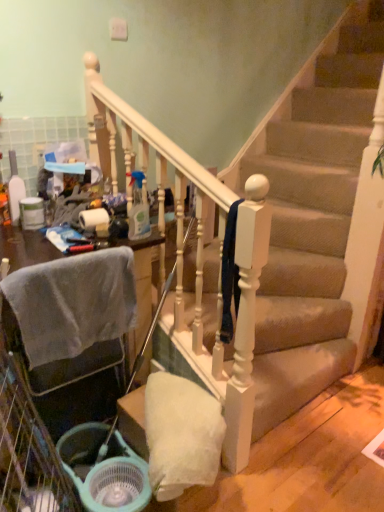
Image resolution: width=384 pixels, height=512 pixels. What do you see at coordinates (15, 189) in the screenshot? I see `translucent plastic spray bottle at left, which is counted as the 2th bottle, starting from the right` at bounding box center [15, 189].

Locate an element on the screen. light blue plastic shopping basket at lower left is located at coordinates (105, 470).

What is the approximate width of gray fabric chair at left?

gray fabric chair at left is 3.54 inches wide.

Where is `carpeted stairs at center`? The height and width of the screenshot is (512, 384). carpeted stairs at center is located at coordinates (317, 221).

Is translucent plastic spray bottle at left, which is counted as the 2th bottle, starting from the right, wider or thinner than carpeted stairs at center?

Clearly, translucent plastic spray bottle at left, which is counted as the 2th bottle, starting from the right, has less width compared to carpeted stairs at center.

In terms of size, does translucent plastic spray bottle at left, the first bottle positioned from the left, appear bigger or smaller than carpeted stairs at center?

Clearly, translucent plastic spray bottle at left, the first bottle positioned from the left, is smaller in size than carpeted stairs at center.

Consider the image. Do you think translucent plastic spray bottle at left, the first bottle positioned from the left, is within carpeted stairs at center, or outside of it?

translucent plastic spray bottle at left, the first bottle positioned from the left, is not enclosed by carpeted stairs at center.

Consider the image. How different are the orientations of translucent plastic spray bottle at left, which is counted as the 2th bottle, starting from the right, and carpeted stairs at center in degrees?

There is a 89.1-degree angle between the facing directions of translucent plastic spray bottle at left, which is counted as the 2th bottle, starting from the right, and carpeted stairs at center.

From the image's perspective, would you say carpeted stairs at center is shown under clear plastic spray bottle at center, which ranks as the second bottle in left-to-right order?

Yes.

Looking at this image, between carpeted stairs at center and clear plastic spray bottle at center, the 1th bottle in the right-to-left sequence, which one has more height?

carpeted stairs at center.

Is carpeted stairs at center smaller than clear plastic spray bottle at center, the 1th bottle in the right-to-left sequence?

No, carpeted stairs at center is not smaller than clear plastic spray bottle at center, the 1th bottle in the right-to-left sequence.

From the image's perspective, between clear plastic spray bottle at center, the 1th bottle in the right-to-left sequence, and white glossy toilet paper at upper left, which one is located above?

clear plastic spray bottle at center, the 1th bottle in the right-to-left sequence, is shown above in the image.

Does point (134, 221) come farther from viewer compared to point (102, 223)?

No.

Between clear plastic spray bottle at center, the 1th bottle in the right-to-left sequence, and white glossy toilet paper at upper left, which one has smaller size?

white glossy toilet paper at upper left.

Identify the location of bottle that is the 1st object above the white glossy toilet paper at upper left (from a real-world perspective). The width and height of the screenshot is (384, 512). (138, 209).

From a real-world perspective, is translucent plastic spray bottle at left, the first bottle positioned from the left, located beneath white glossy toilet paper at upper left?

No, from a real-world perspective, translucent plastic spray bottle at left, the first bottle positioned from the left, is not under white glossy toilet paper at upper left.

Can you confirm if translucent plastic spray bottle at left, which is counted as the 2th bottle, starting from the right, is shorter than white glossy toilet paper at upper left?

No, translucent plastic spray bottle at left, which is counted as the 2th bottle, starting from the right, is not shorter than white glossy toilet paper at upper left.

Is translucent plastic spray bottle at left, the first bottle positioned from the left, in front of or behind white glossy toilet paper at upper left in the image?

Clearly, translucent plastic spray bottle at left, the first bottle positioned from the left, is behind white glossy toilet paper at upper left.

Does point (11, 210) come behind point (154, 234)?

Yes.

From the image's perspective, is translucent plastic spray bottle at left, the first bottle positioned from the left, positioned above or below gray fabric chair at left?

Clearly, from the image's perspective, translucent plastic spray bottle at left, the first bottle positioned from the left, is above gray fabric chair at left.

Does translucent plastic spray bottle at left, the first bottle positioned from the left, have a greater height compared to gray fabric chair at left?

No.

Find the location of a particular element. The width and height of the screenshot is (384, 512). stairs on the right of the gray fabric chair at left is located at coordinates (317, 221).

From a real-world perspective, who is located higher, gray fabric chair at left or carpeted stairs at center?

carpeted stairs at center is physically above.

Can you tell me how much gray fabric chair at left and carpeted stairs at center differ in facing direction?

The angular difference between gray fabric chair at left and carpeted stairs at center is 89.1 degrees.

Is gray fabric chair at left taller than carpeted stairs at center?

Incorrect, the height of gray fabric chair at left is not larger of that of carpeted stairs at center.

Is light blue plastic shopping basket at lower left taller than carpeted stairs at center?

In fact, light blue plastic shopping basket at lower left may be shorter than carpeted stairs at center.

From the image's perspective, is light blue plastic shopping basket at lower left above or below carpeted stairs at center?

light blue plastic shopping basket at lower left is situated lower than carpeted stairs at center in the image.

Locate an element on the screen. This screenshot has width=384, height=512. shopping basket that is below the carpeted stairs at center (from the image's perspective) is located at coordinates (105, 470).

Which object is more forward, light blue plastic shopping basket at lower left or carpeted stairs at center?

carpeted stairs at center is closer to the camera.

At what (x,y) coordinates should I click in order to perform the action: click on the 2nd bottle positioned above the carpeted stairs at center (from a real-world perspective). Please return your answer as a coordinate pair (x, y). Looking at the image, I should click on (15, 189).

The width and height of the screenshot is (384, 512). In order to click on stairs below the clear plastic spray bottle at center, the 1th bottle in the right-to-left sequence (from the image's perspective) in this screenshot , I will do `click(317, 221)`.

Considering their positions, is light blue plastic shopping basket at lower left positioned further to white glossy toilet paper at upper left than clear plastic spray bottle at center, which ranks as the second bottle in left-to-right order?

light blue plastic shopping basket at lower left lies further to white glossy toilet paper at upper left than the other object.

From the image, which object appears to be farther from clear plastic spray bottle at center, the 1th bottle in the right-to-left sequence, carpeted stairs at center or light blue plastic shopping basket at lower left?

The object further to clear plastic spray bottle at center, the 1th bottle in the right-to-left sequence, is carpeted stairs at center.

Which object lies further to the anchor point translucent plastic spray bottle at left, the first bottle positioned from the left, gray fabric chair at left or clear plastic spray bottle at center, the 1th bottle in the right-to-left sequence?

clear plastic spray bottle at center, the 1th bottle in the right-to-left sequence.

Based on their spatial positions, is light blue plastic shopping basket at lower left or clear plastic spray bottle at center, the 1th bottle in the right-to-left sequence, closer to carpeted stairs at center?

The object closer to carpeted stairs at center is clear plastic spray bottle at center, the 1th bottle in the right-to-left sequence.

Looking at the image, which one is located further to light blue plastic shopping basket at lower left, white glossy toilet paper at upper left or carpeted stairs at center?

A: carpeted stairs at center is further to light blue plastic shopping basket at lower left.

Considering their positions, is translucent plastic spray bottle at left, the first bottle positioned from the left, positioned further to light blue plastic shopping basket at lower left than clear plastic spray bottle at center, the 1th bottle in the right-to-left sequence?

Based on the image, translucent plastic spray bottle at left, the first bottle positioned from the left, appears to be further to light blue plastic shopping basket at lower left.

Considering their positions, is translucent plastic spray bottle at left, the first bottle positioned from the left, positioned closer to carpeted stairs at center than light blue plastic shopping basket at lower left?

light blue plastic shopping basket at lower left lies closer to carpeted stairs at center than the other object.

Based on their spatial positions, is clear plastic spray bottle at center, which ranks as the second bottle in left-to-right order, or white glossy toilet paper at upper left further from carpeted stairs at center?

white glossy toilet paper at upper left is further to carpeted stairs at center.

Locate an element on the screen. The width and height of the screenshot is (384, 512). stairs between clear plastic spray bottle at center, the 1th bottle in the right-to-left sequence, and light blue plastic shopping basket at lower left, in the vertical direction is located at coordinates (317, 221).

This screenshot has width=384, height=512. I want to click on furniture between translucent plastic spray bottle at left, which is counted as the 2th bottle, starting from the right, and clear plastic spray bottle at center, which ranks as the second bottle in left-to-right order, from left to right, so click(x=142, y=285).

At what (x,y) coordinates should I click in order to perform the action: click on bottle between carpeted stairs at center and white glossy toilet paper at upper left along the z-axis. Please return your answer as a coordinate pair (x, y). Looking at the image, I should click on (138, 209).

At what (x,y) coordinates should I click in order to perform the action: click on furniture between translucent plastic spray bottle at left, which is counted as the 2th bottle, starting from the right, and light blue plastic shopping basket at lower left vertically. Please return your answer as a coordinate pair (x, y). Looking at the image, I should click on (142, 285).